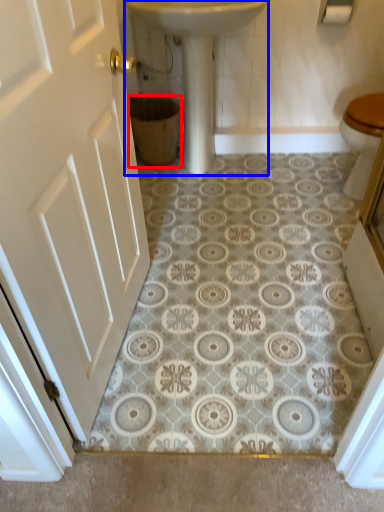
Question: Which of the following is the closest to the observer, basket (highlighted by a red box) or sink (highlighted by a blue box)?

Choices:
 (A) basket
 (B) sink

Answer: (B)